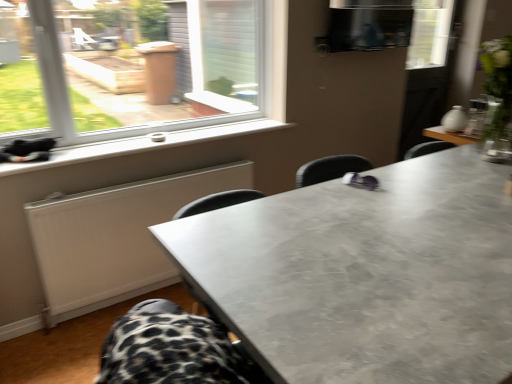
Locate an element on the screen. Image resolution: width=512 pixels, height=384 pixels. free spot above white matte radiator at lower left (from a real-world perspective) is located at coordinates (151, 180).